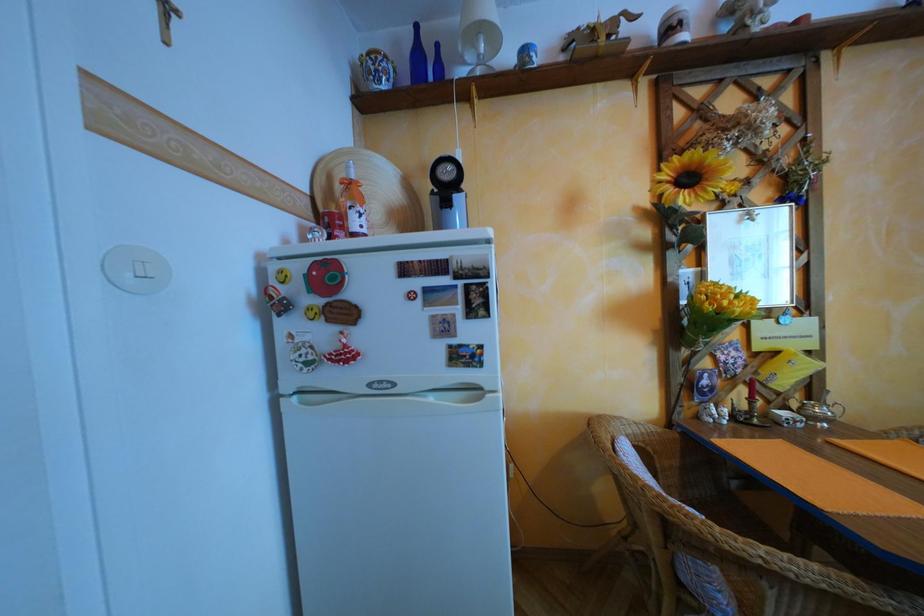
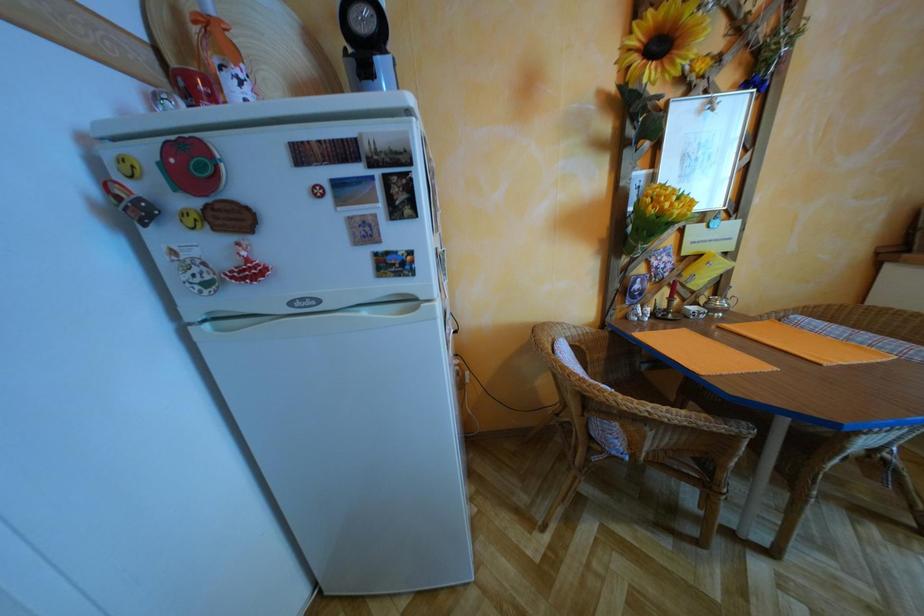
Which direction would the cameraman need to move to produce the second image?

The movement direction of the cameraman is right, forward.